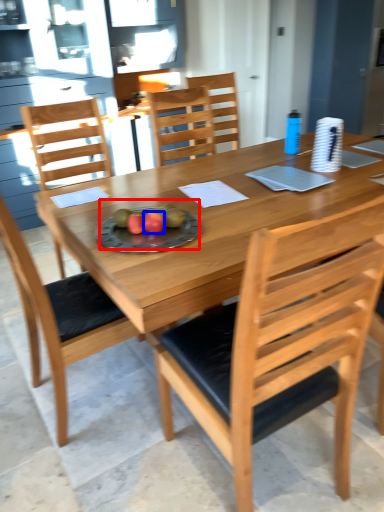
Question: Among these objects, which one is farthest to the camera, fruit dish (highlighted by a red box) or fruit (highlighted by a blue box)?

Choices:
 (A) fruit dish
 (B) fruit

Answer: (B)